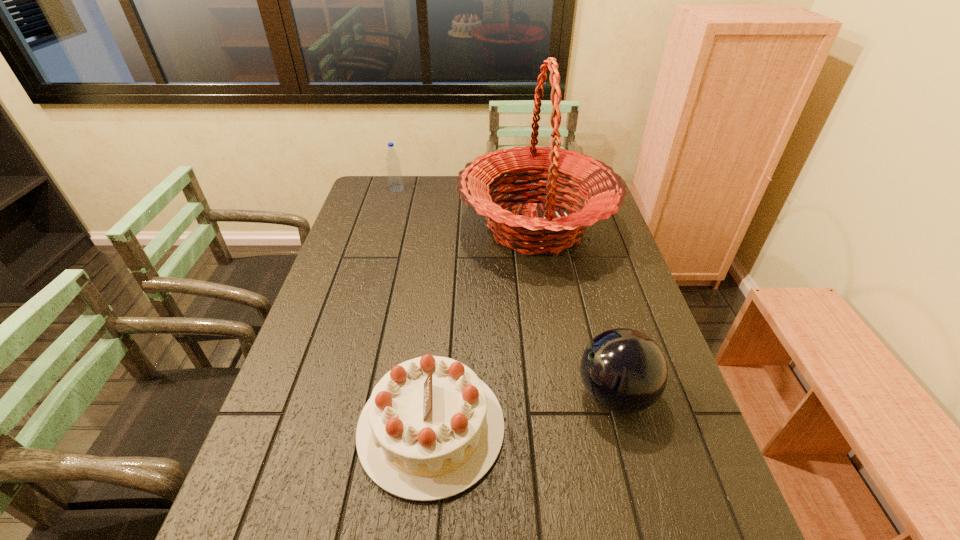
I want to click on free space at the far left corner of the desktop, so click(392, 193).

You are a GUI agent. You are given a task and a screenshot of the screen. Output one action in this format:
    pyautogui.click(x=<x>, y=<y>)
    Task: Click on the vacant space in between the birthday cake and the water bottle
    The width and height of the screenshot is (960, 540).
    Given the screenshot: What is the action you would take?
    pyautogui.click(x=414, y=308)

Where is `empty location between the water bottle and the basket`? The width and height of the screenshot is (960, 540). empty location between the water bottle and the basket is located at coordinates pyautogui.click(x=467, y=208).

Locate an element on the screen. The width and height of the screenshot is (960, 540). free space between the tallest object and the birthday cake is located at coordinates (484, 327).

I want to click on free space between the basket and the bowling ball, so click(x=575, y=311).

Find the location of a particular element. unoccupied area between the leftmost object and the bowling ball is located at coordinates (506, 292).

Where is `vacant area that lies between the water bottle and the birthday cake`? vacant area that lies between the water bottle and the birthday cake is located at coordinates (414, 308).

Find the location of a particular element. The height and width of the screenshot is (540, 960). vacant area that lies between the tallest object and the birthday cake is located at coordinates point(484,327).

You are a GUI agent. You are given a task and a screenshot of the screen. Output one action in this format:
    pyautogui.click(x=<x>, y=<y>)
    Task: Click on the free space between the shortest object and the basket
    The height and width of the screenshot is (540, 960).
    Given the screenshot: What is the action you would take?
    pyautogui.click(x=484, y=327)

Identify the location of vacant space that's between the tallest object and the leftmost object. (467, 208).